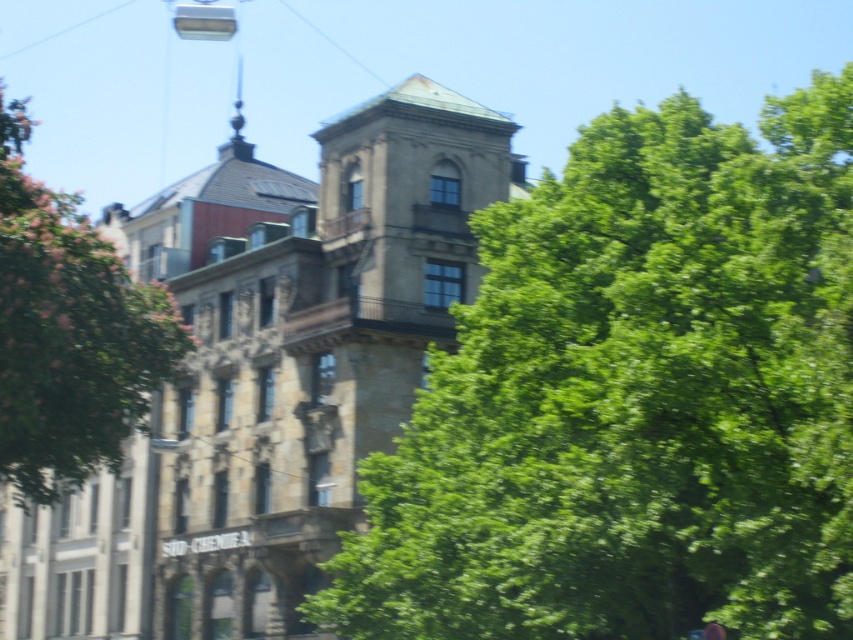
Question: Which of these objects is positioned farthest from the green leafy tree at left?

Choices:
 (A) stone textured bell tower at center
 (B) green leafy tree at center

Answer: (B)

Question: From the image, what is the correct spatial relationship of stone textured bell tower at center in relation to green leafy tree at left?

Choices:
 (A) above
 (B) below

Answer: (B)

Question: Which object appears closest to the camera in this image?

Choices:
 (A) green leafy tree at center
 (B) green leafy tree at left

Answer: (A)

Question: Is green leafy tree at center thinner than green leafy tree at left?

Choices:
 (A) yes
 (B) no

Answer: (A)

Question: Does green leafy tree at center come behind green leafy tree at left?

Choices:
 (A) yes
 (B) no

Answer: (B)

Question: Based on their relative distances, which object is farther from the stone textured bell tower at center?

Choices:
 (A) green leafy tree at center
 (B) green leafy tree at left

Answer: (A)